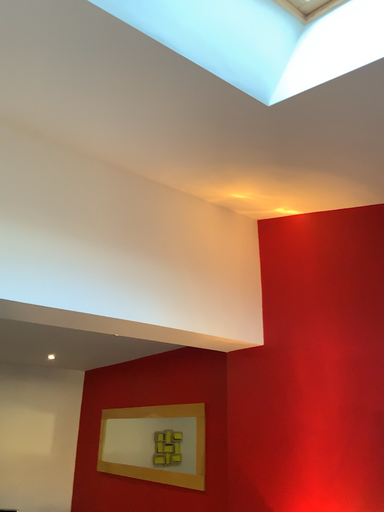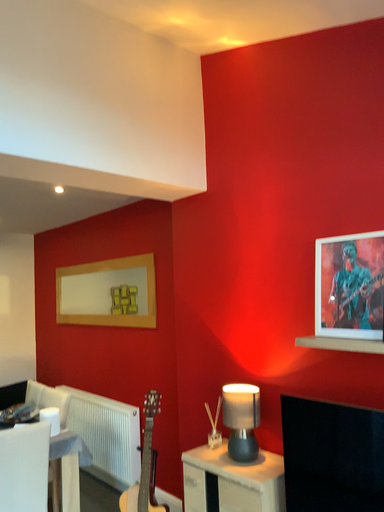
Question: How did the camera likely rotate when shooting the video?

Choices:
 (A) rotated downward
 (B) rotated upward

Answer: (A)